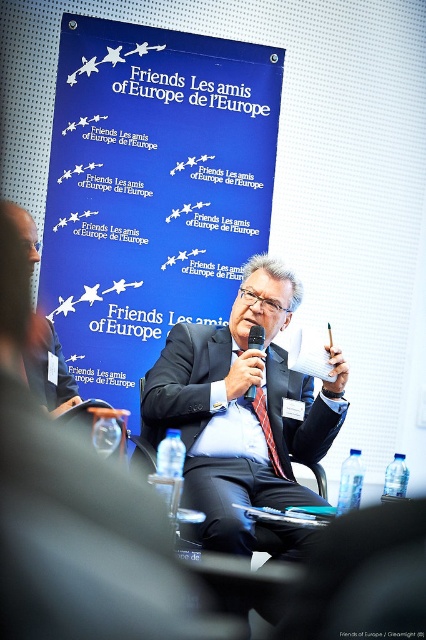
Who is taller, dark blue fabric business suit at center or matte black microphone at center?

Standing taller between the two is dark blue fabric business suit at center.

In the scene shown: Can you confirm if dark blue fabric business suit at center is positioned to the left of matte black microphone at center?

Yes, dark blue fabric business suit at center is to the left of matte black microphone at center.

The height and width of the screenshot is (640, 426). I want to click on dark blue fabric business suit at center, so click(224, 417).

Find the location of a particular element. The height and width of the screenshot is (640, 426). dark blue fabric business suit at center is located at coordinates (224, 417).

Between red silk tie at center and matte black microphone at center, which one has less height?

With less height is matte black microphone at center.

Can you confirm if red silk tie at center is positioned below matte black microphone at center?

Correct, red silk tie at center is located below matte black microphone at center.

Does point (253, 406) lie in front of point (255, 388)?

That is False.

At what (x,y) coordinates should I click in order to perform the action: click on red silk tie at center. Please return your answer as a coordinate pair (x, y). Image resolution: width=426 pixels, height=640 pixels. Looking at the image, I should click on (264, 426).

Where is `dark blue fabric business suit at center`? dark blue fabric business suit at center is located at coordinates point(224,417).